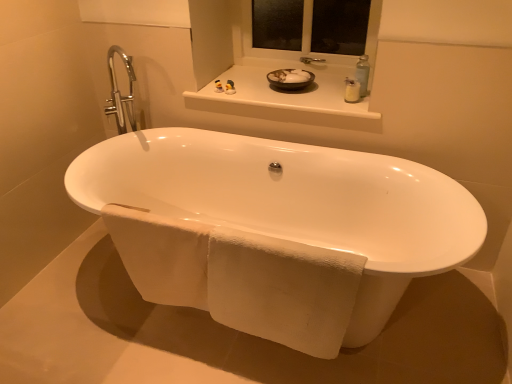
Locate an element on the screen. This screenshot has height=384, width=512. free space in front of white plastic soap dispenser at upper right, the first toiletry when ordered from right to left is located at coordinates (353, 113).